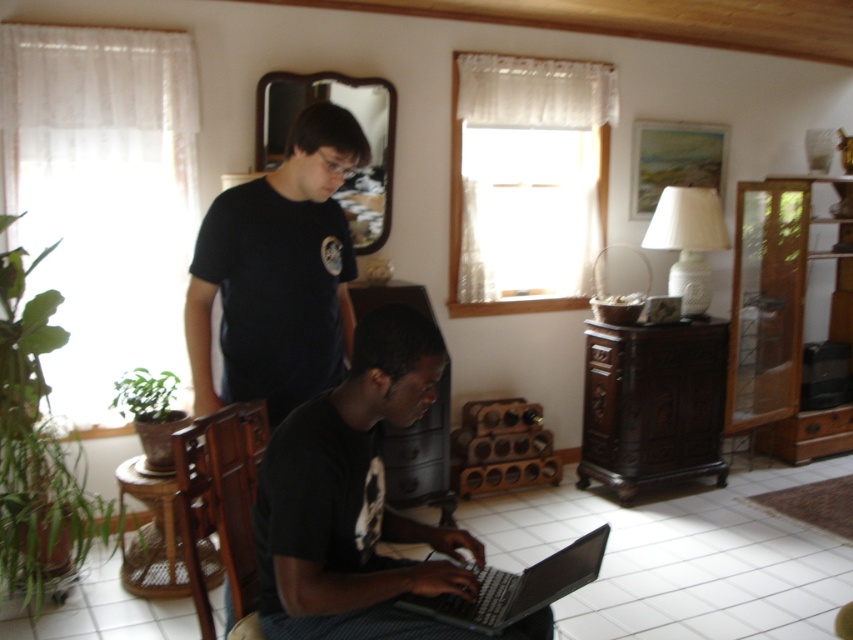
Question: Which point is closer to the camera?

Choices:
 (A) black matte laptop at lower center
 (B) wooden chair at center

Answer: (A)

Question: Which of the following is the farthest from the observer?

Choices:
 (A) (196, 508)
 (B) (549, 560)
 (C) (349, 253)

Answer: (C)

Question: Is wooden chair at center smaller than silver metallic laptop at lower center?

Choices:
 (A) no
 (B) yes

Answer: (A)

Question: Does wooden chair at center have a smaller size compared to silver metallic laptop at lower center?

Choices:
 (A) yes
 (B) no

Answer: (B)

Question: Is wooden chair at center above silver metallic laptop at lower center?

Choices:
 (A) yes
 (B) no

Answer: (A)

Question: Which point appears farthest from the camera in this image?

Choices:
 (A) (347, 602)
 (B) (305, 353)

Answer: (B)